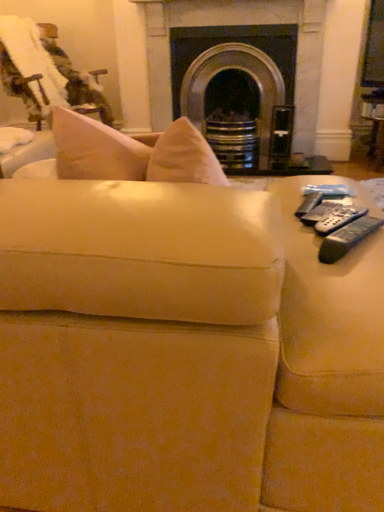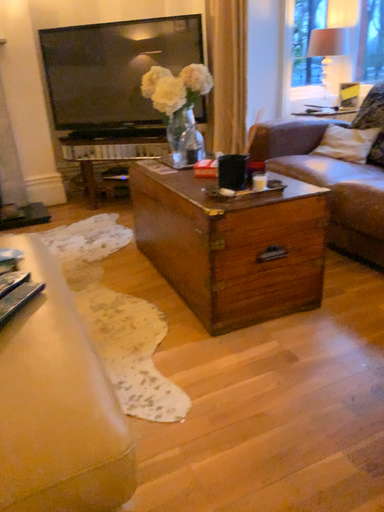
Question: How did the camera likely rotate when shooting the video?

Choices:
 (A) rotated right
 (B) rotated left

Answer: (A)